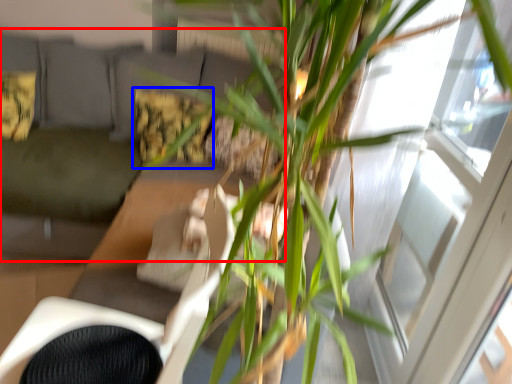
Question: Which object appears farthest to the camera in this image, couch (highlighted by a red box) or pillow (highlighted by a blue box)?

Choices:
 (A) couch
 (B) pillow

Answer: (B)